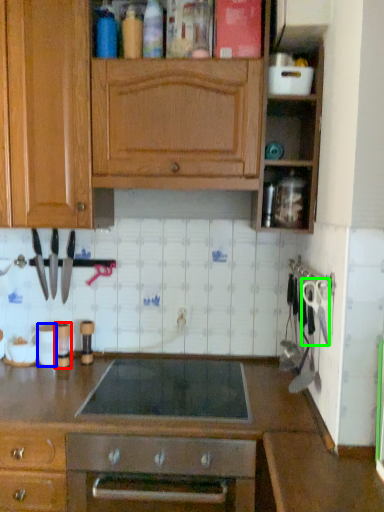
Question: Based on their relative distances, which object is farther from appliance (highlighted by a red box)? Choose from appliance (highlighted by a blue box) and scissors (highlighted by a green box).

Choices:
 (A) appliance
 (B) scissors

Answer: (B)